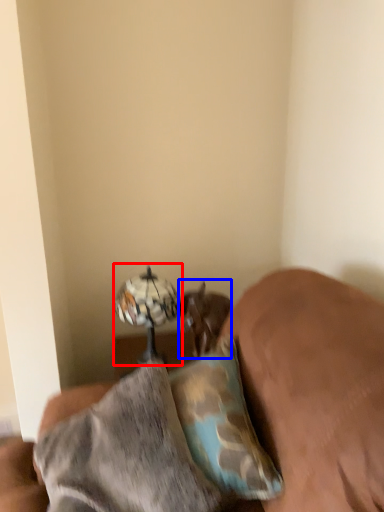
Question: Among these objects, which one is nearest to the camera, table lamp (highlighted by a red box) or animal (highlighted by a blue box)?

Choices:
 (A) table lamp
 (B) animal

Answer: (A)